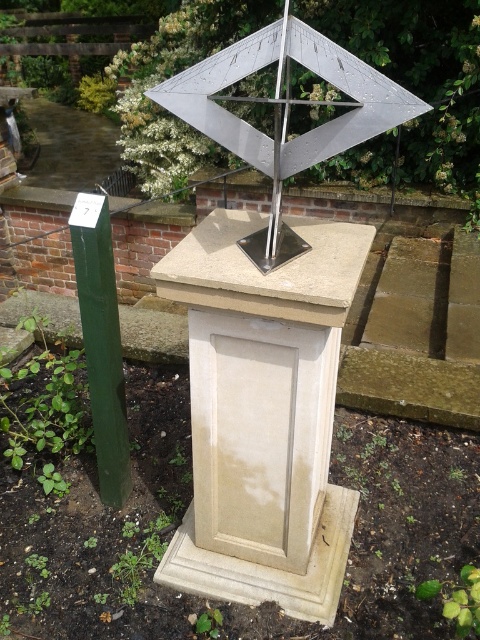
You are standing in the garden and want to find the metallic silver sundial at center. According to the coordinates provided, where should you look relative to the garden layout?

The metallic silver sundial at center is located at coordinates 0.180 on the x axis and 0.594 on the y axis, so you should look towards the lower left area of the garden layout.

Consider the image. You are a gardener who wants to install a new flower bed between the metallic silver sundial at center and the green polished wood post at left. Which object should you place the flower bed closer to if you want it to be closer to the taller object?

The green polished wood post at left is taller than the metallic silver sundial at center, so you should place the flower bed closer to the green polished wood post at left to be near the taller object.

You are standing in front of the sundial structure and want to touch both the metallic silver sundial at center and the metallic pole at center. Which object should you reach for first to touch the one closer to you?

The metallic silver sundial at center is closer to the viewer than the metallic pole at center, so you should reach for the metallic silver sundial at center first.